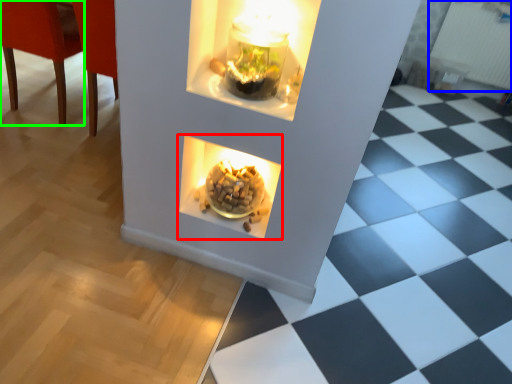
Question: Considering the real-world distances, which object is farthest from fireplace (highlighted by a red box)? radiator (highlighted by a blue box) or chair (highlighted by a green box)?

Choices:
 (A) radiator
 (B) chair

Answer: (A)